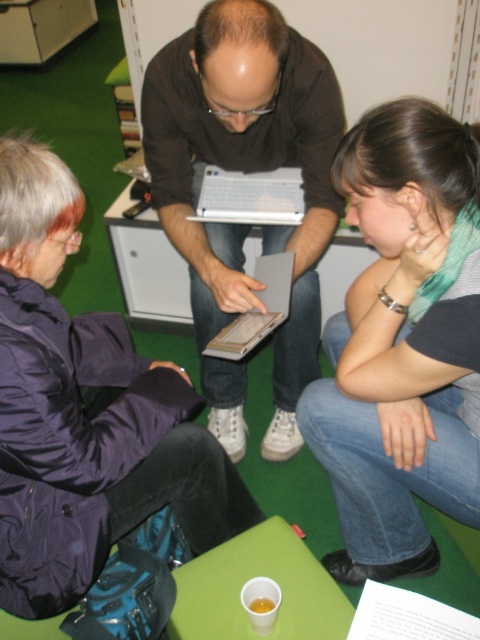
You are a delivery person trying to place a small package on the floor between the denim jeans at lower right and the satin silver laptop at center. Based on the space available, can you fit the package there?

The denim jeans at lower right might be wider than the satin silver laptop at center, so there might not be enough space to fit the package between them.

You are a photographer setting up a tripod to capture the denim jeans at lower right and the purple satin jacket at upper left. Since you want to focus on the closest object, which one should you adjust your camera settings for?

The denim jeans at lower right is closer to you than the purple satin jacket at upper left, so you should adjust your camera settings to focus on the denim jeans at lower right.